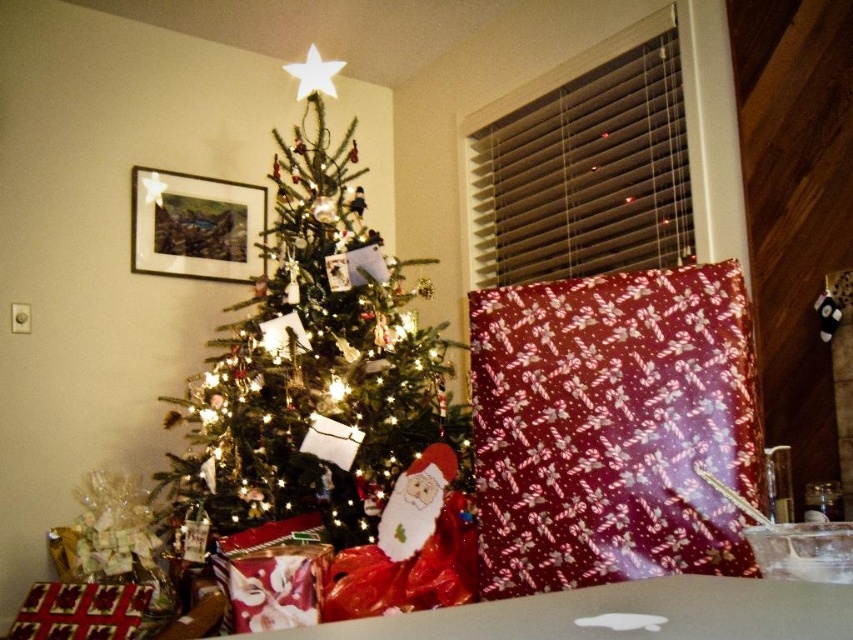
Is candy cane patterned paper at center shorter than felt santa claus at center?

No.

The height and width of the screenshot is (640, 853). What do you see at coordinates (612, 428) in the screenshot?
I see `candy cane patterned paper at center` at bounding box center [612, 428].

The width and height of the screenshot is (853, 640). I want to click on candy cane patterned paper at center, so click(612, 428).

Who is higher up, candy cane patterned paper at center or green matte christmas tree at center?

green matte christmas tree at center is higher up.

Is point (660, 282) positioned after point (242, 472)?

No, it is not.

This screenshot has width=853, height=640. I want to click on candy cane patterned paper at center, so click(x=612, y=428).

Measure the distance between point (387, 307) and camera.

The distance of point (387, 307) from camera is 2.17 meters.

What do you see at coordinates (314, 360) in the screenshot? I see `green matte christmas tree at center` at bounding box center [314, 360].

Locate an element on the screen. green matte christmas tree at center is located at coordinates (314, 360).